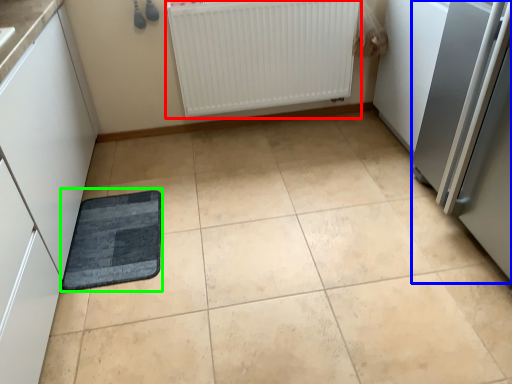
Question: Estimate the real-world distances between objects in this image. Which object is farther from radiator (highlighted by a red box), appliance (highlighted by a blue box) or mat (highlighted by a green box)?

Choices:
 (A) appliance
 (B) mat

Answer: (B)